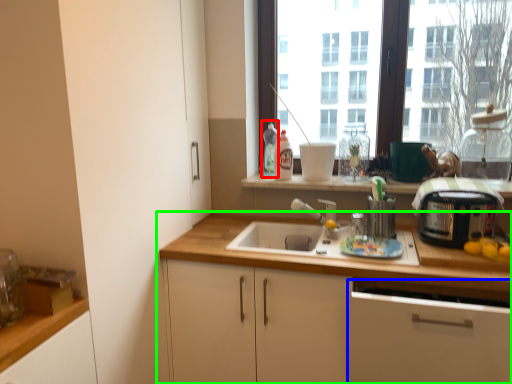
Question: Estimate the real-world distances between objects in this image. Which object is farther from bottle (highlighted by a red box), cabinetry (highlighted by a blue box) or cabinetry (highlighted by a green box)?

Choices:
 (A) cabinetry
 (B) cabinetry

Answer: (A)